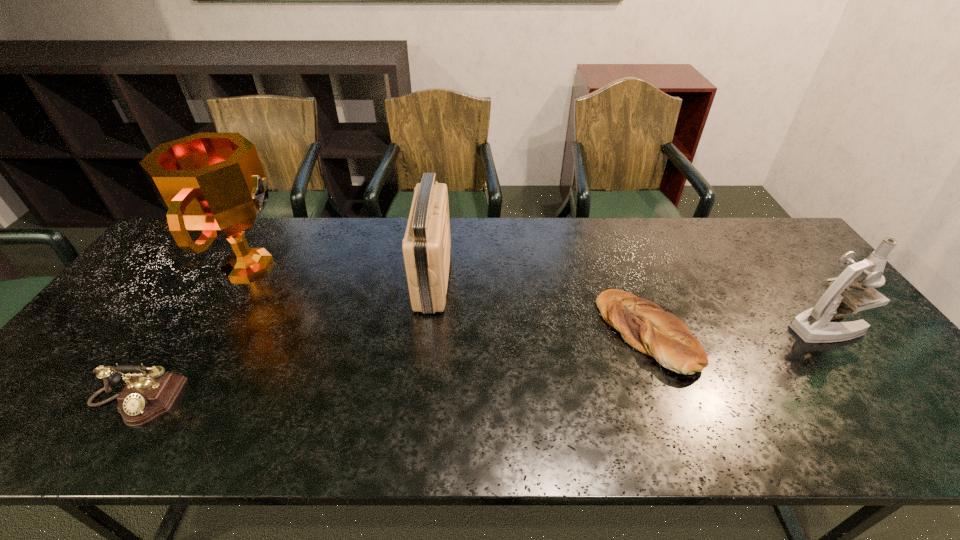
This screenshot has height=540, width=960. Identify the location of empty space between the fourth tallest object and the rightmost object. (479, 364).

Find the location of a particular element. The height and width of the screenshot is (540, 960). free space between the award and the fourth object from left to right is located at coordinates (448, 299).

Locate an element on the screen. empty space between the rightmost object and the telephone is located at coordinates (479, 364).

Image resolution: width=960 pixels, height=540 pixels. What are the coordinates of `vacant space that's between the telephone and the fourth object from left to right` in the screenshot? It's located at (391, 367).

Where is `vacant space in between the rightmost object and the award`? vacant space in between the rightmost object and the award is located at coordinates (537, 296).

This screenshot has height=540, width=960. Identify the location of free area in between the shortest object and the telephone. (391, 367).

In order to click on free area in between the telephone and the third object from left to right in this screenshot , I will do click(x=284, y=340).

In order to click on vacant point located between the radio receiver and the fourth tallest object in this screenshot , I will do `click(284, 340)`.

This screenshot has width=960, height=540. Identify the location of the closest object to the third object from right to left. (213, 185).

Identify the location of the fourth closest object to the shortest object. This screenshot has width=960, height=540. (145, 396).